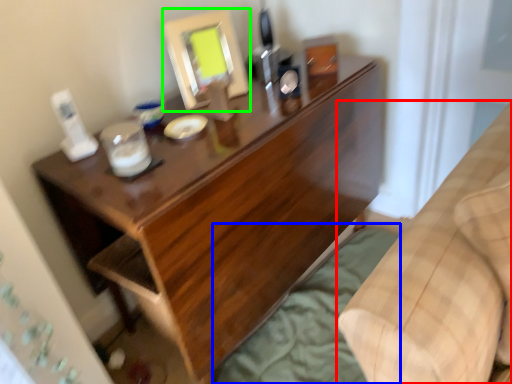
Question: Based on their relative distances, which object is nearer to furniture (highlighted by a red box)? Choose from sheet (highlighted by a blue box) and mirror (highlighted by a green box).

Choices:
 (A) sheet
 (B) mirror

Answer: (A)